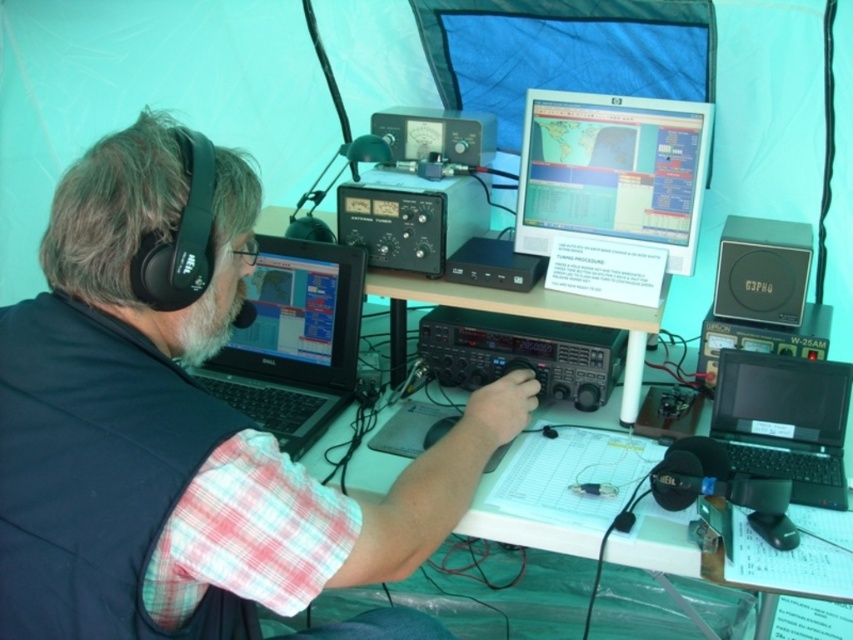
Question: Which point appears farthest from the camera in this image?

Choices:
 (A) (251, 344)
 (B) (730, 413)
 (C) (502, 305)

Answer: (A)

Question: Can you confirm if black matte laptop at upper left is positioned to the right of black plastic laptop at right?

Choices:
 (A) yes
 (B) no

Answer: (B)

Question: Among these points, which one is nearest to the camera?

Choices:
 (A) (527, 124)
 (B) (811, 394)

Answer: (B)

Question: Considering the relative positions of matte black laptop at center and matte black speaker at right in the image provided, where is matte black laptop at center located with respect to matte black speaker at right?

Choices:
 (A) above
 (B) below

Answer: (B)

Question: Does black matte laptop at upper left appear over white plastic table at center?

Choices:
 (A) no
 (B) yes

Answer: (A)

Question: Which of the following is the closest to the observer?

Choices:
 (A) (259, 236)
 (B) (601, 236)

Answer: (B)